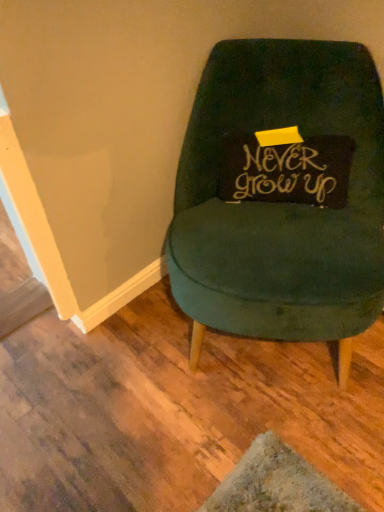
Question: Is point (203, 301) closer or farther from the camera than point (332, 153)?

Choices:
 (A) closer
 (B) farther

Answer: (A)

Question: In terms of width, does velvet green chair at center look wider or thinner when compared to gold calligraphy pillow at center?

Choices:
 (A) thin
 (B) wide

Answer: (B)

Question: Is velvet green chair at center to the left or to the right of gold calligraphy pillow at center in the image?

Choices:
 (A) left
 (B) right

Answer: (A)

Question: Visually, is gold calligraphy pillow at center positioned to the left or to the right of velvet green chair at center?

Choices:
 (A) right
 (B) left

Answer: (A)

Question: Is gold calligraphy pillow at center wider or thinner than velvet green chair at center?

Choices:
 (A) wide
 (B) thin

Answer: (B)

Question: From a real-world perspective, is gold calligraphy pillow at center physically located above or below velvet green chair at center?

Choices:
 (A) above
 (B) below

Answer: (A)

Question: In the image, is gold calligraphy pillow at center positioned in front of or behind velvet green chair at center?

Choices:
 (A) front
 (B) behind

Answer: (B)